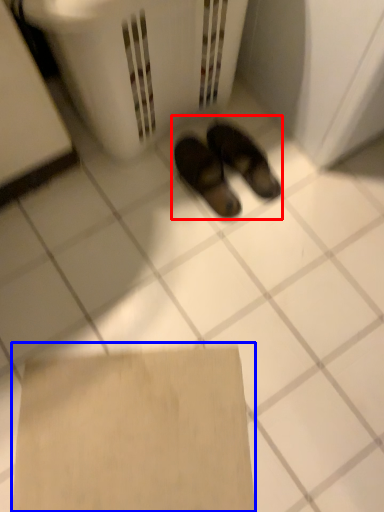
Question: Which of the following is the closest to the observer, footwear (highlighted by a red box) or cardboard (highlighted by a blue box)?

Choices:
 (A) footwear
 (B) cardboard

Answer: (B)